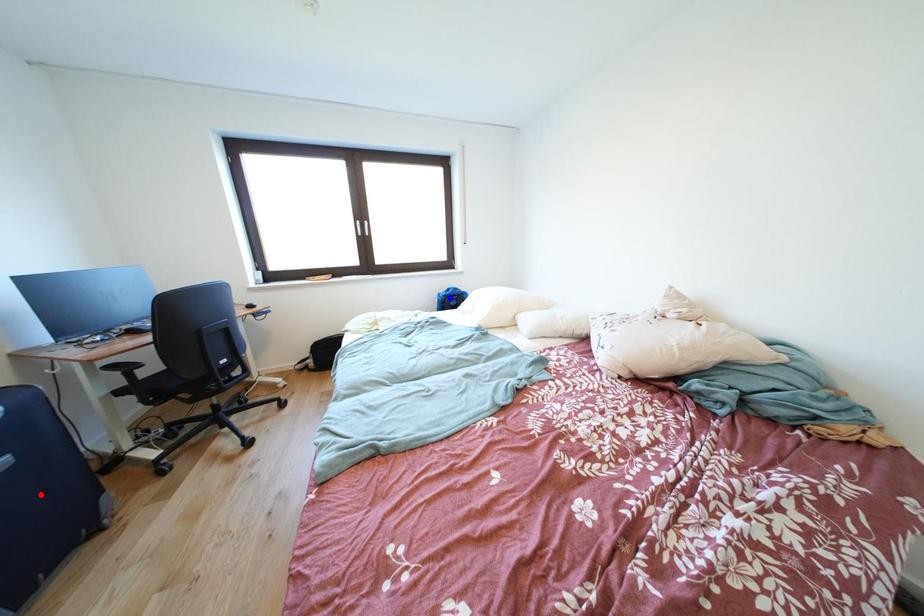
Question: Two points are marked on the image. Which point is closer to the camera?

Choices:
 (A) Blue point is closer.
 (B) Red point is closer.

Answer: (B)